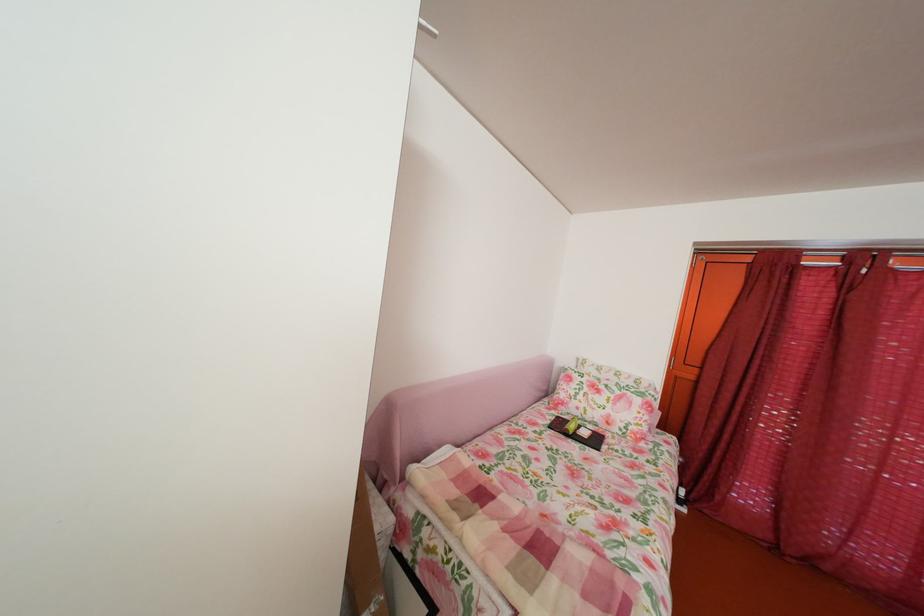
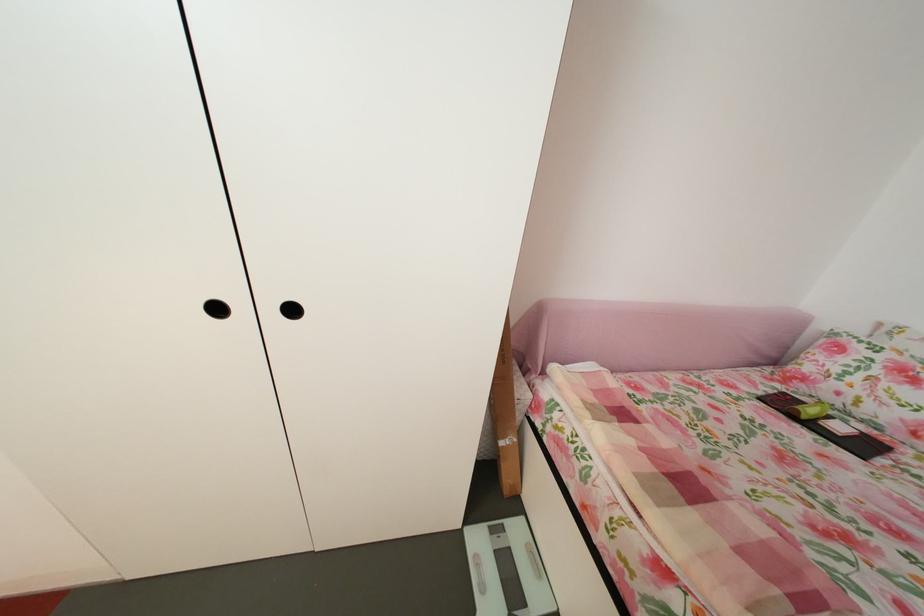
Find the pixel in the second image that matches (397,483) in the first image.

(541, 371)